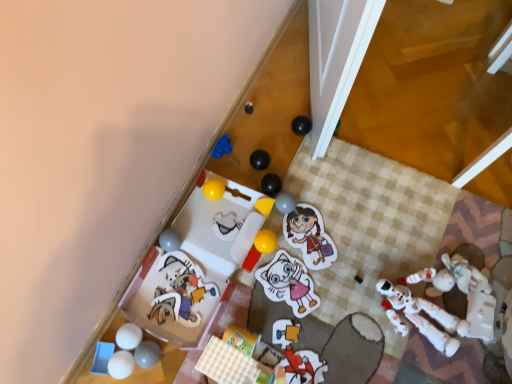
Locate an element on the screen. Image resolution: width=512 pixels, height=384 pixels. vacant space that is in between yellow matte block at upper center, placed as the 11th toy when sorted from left to right, and matte gray ball at lower left, which is counted as the twelfth toy, starting from the right is located at coordinates (209, 279).